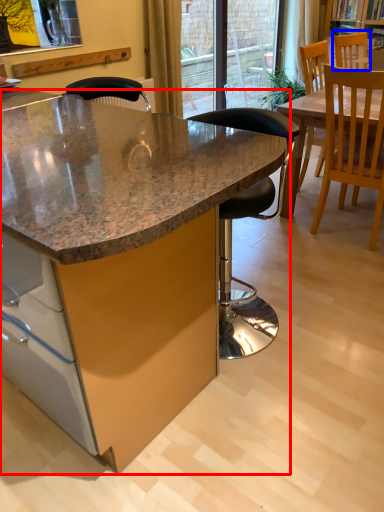
Question: Which point is further to the camera, table (highlighted by a red box) or chair (highlighted by a blue box)?

Choices:
 (A) table
 (B) chair

Answer: (B)